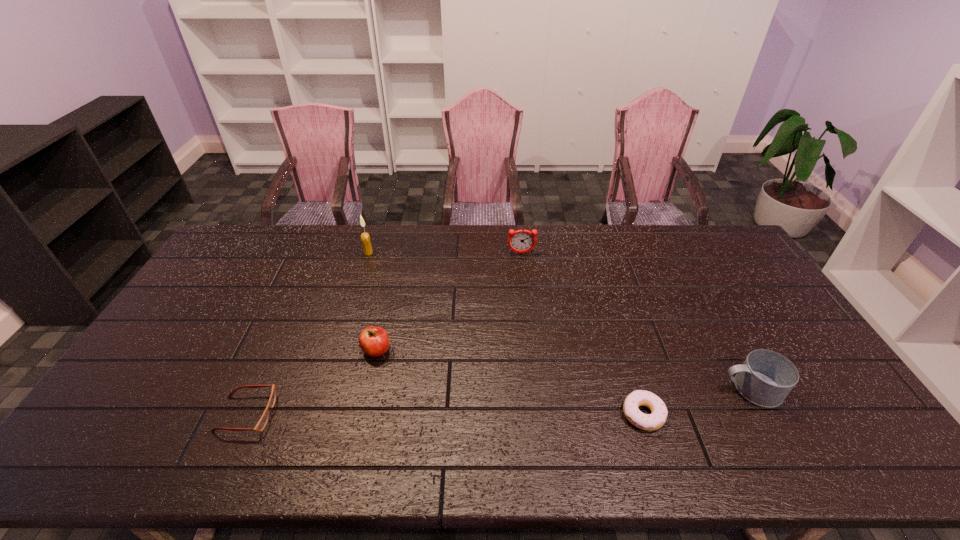
Locate an element on the screen. free space between the spectacles and the apple is located at coordinates tap(311, 382).

You are a GUI agent. You are given a task and a screenshot of the screen. Output one action in this format:
    pyautogui.click(x=<x>, y=<y>)
    Task: Click on the free spot between the rightmost object and the third object from right to left
    The width and height of the screenshot is (960, 540).
    Given the screenshot: What is the action you would take?
    pyautogui.click(x=636, y=321)

Where is `free area in between the rightmost object and the second object from right to left`? The height and width of the screenshot is (540, 960). free area in between the rightmost object and the second object from right to left is located at coordinates (697, 402).

Where is `vacant space in between the fifth object from right to left and the spectacles`? Image resolution: width=960 pixels, height=540 pixels. vacant space in between the fifth object from right to left and the spectacles is located at coordinates (307, 333).

Locate which object ranks in proximity to the candle. Please provide its 2D coordinates. Your answer should be formatted as a tuple, i.e. [(x, y)], where the tuple contains the x and y coordinates of a point satisfying the conditions above.

[(374, 341)]

Identify which object is located as the fourth nearest to the rightmost object. Please provide its 2D coordinates. Your answer should be formatted as a tuple, i.e. [(x, y)], where the tuple contains the x and y coordinates of a point satisfying the conditions above.

[(365, 238)]